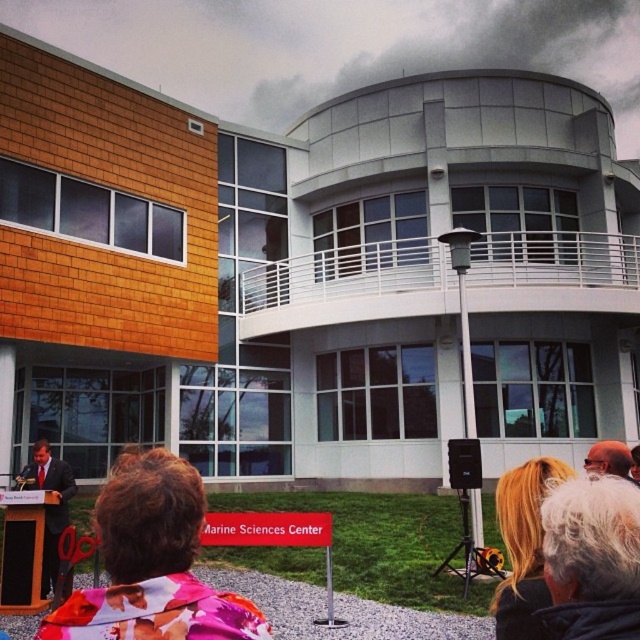
Is point (216, 618) behind point (544, 593)?

That is False.

Between floral fabric jacket at lower center and blonde hair at upper right, which one appears on the left side from the viewer's perspective?

floral fabric jacket at lower center

Is point (83, 602) in front of point (508, 602)?

Yes, it is in front of point (508, 602).

You are a GUI agent. You are given a task and a screenshot of the screen. Output one action in this format:
    pyautogui.click(x=<x>, y=<y>)
    Task: Click on the floral fabric jacket at lower center
    The image size is (640, 640).
    Given the screenshot: What is the action you would take?
    pyautogui.click(x=150, y=563)